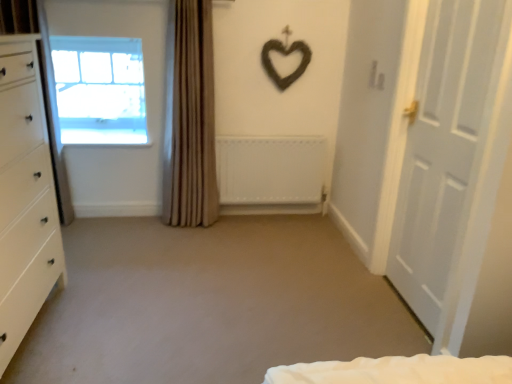
Find the location of `vacant space to the right of white glossy chest of drawers at left`. vacant space to the right of white glossy chest of drawers at left is located at coordinates (125, 327).